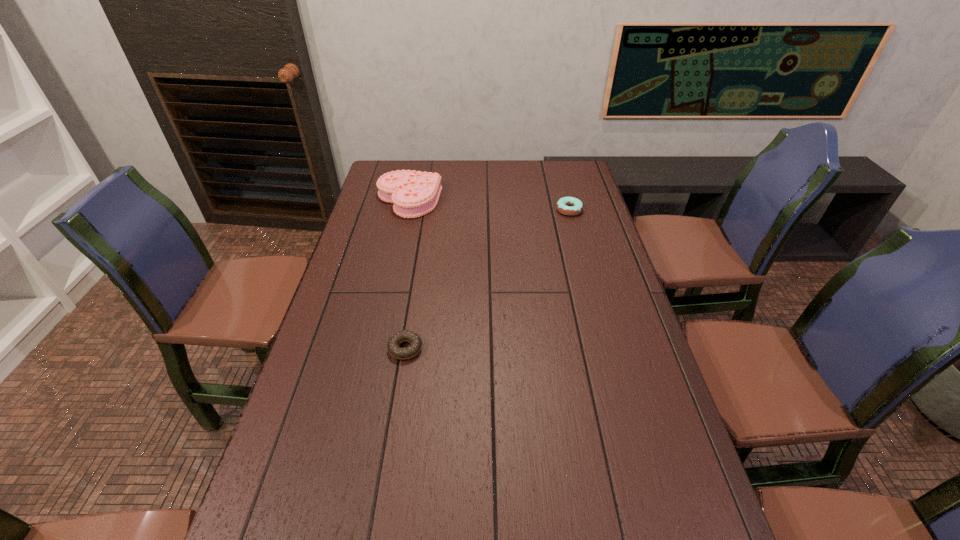
Find the location of a particular element. object that is the second closest to the tallest object is located at coordinates (415, 341).

Locate which object is the closest to the tallest object. Please provide its 2D coordinates. Your answer should be formatted as a tuple, i.e. [(x, y)], where the tuple contains the x and y coordinates of a point satisfying the conditions above.

[(570, 206)]

Identify the location of vacant region that satisfies the following two spatial constraints: 1. on the back side of the farther doughnut; 2. on the right side of the nearest object. (427, 210).